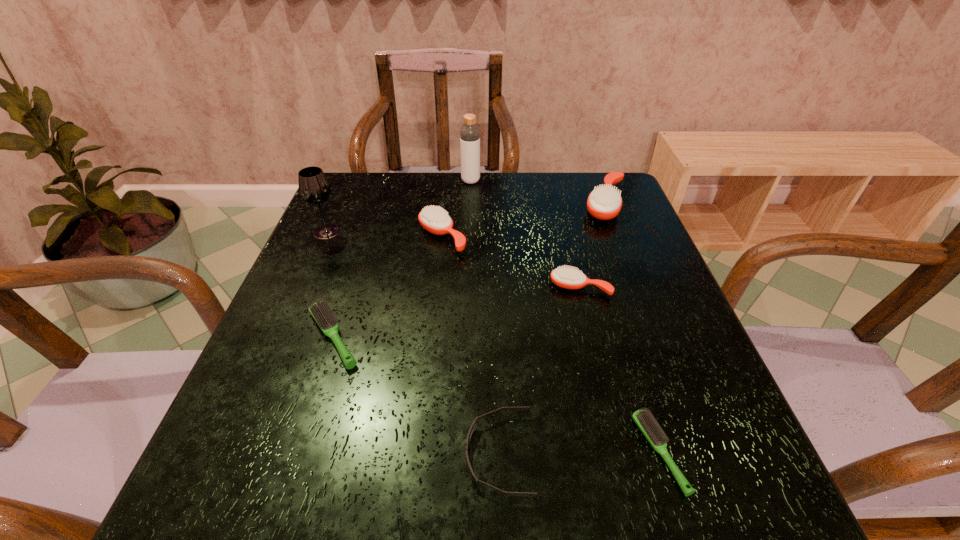
Where is `object that is at the far right corner`? object that is at the far right corner is located at coordinates (605, 202).

The height and width of the screenshot is (540, 960). I want to click on object at the near right corner, so click(644, 420).

The height and width of the screenshot is (540, 960). In the image, there is a desktop. What are the coordinates of `vacant space at the far edge` in the screenshot? It's located at (522, 176).

You are a GUI agent. You are given a task and a screenshot of the screen. Output one action in this format:
    pyautogui.click(x=<x>, y=<y>)
    Task: Click on the vacant area at the near edge
    
    Given the screenshot: What is the action you would take?
    click(x=430, y=525)

Image resolution: width=960 pixels, height=540 pixels. In the image, there is a desktop. What are the coordinates of `free region at the left edge` in the screenshot? It's located at (308, 402).

At what (x,y) coordinates should I click in order to perform the action: click on vacant space at the right edge of the desktop. Please return your answer as a coordinate pair (x, y). The width and height of the screenshot is (960, 540). Looking at the image, I should click on (616, 221).

Image resolution: width=960 pixels, height=540 pixels. I want to click on free region at the far left corner, so click(374, 200).

Find the location of a particular element. The width and height of the screenshot is (960, 540). unoccupied area between the bottle and the sunglasses is located at coordinates (485, 318).

Where is `free spot between the seventh shortest object and the smaller light hairbrush`? free spot between the seventh shortest object and the smaller light hairbrush is located at coordinates (x=493, y=342).

In order to click on unoccupied position between the gray bottle and the third tallest object in this screenshot , I will do `click(539, 192)`.